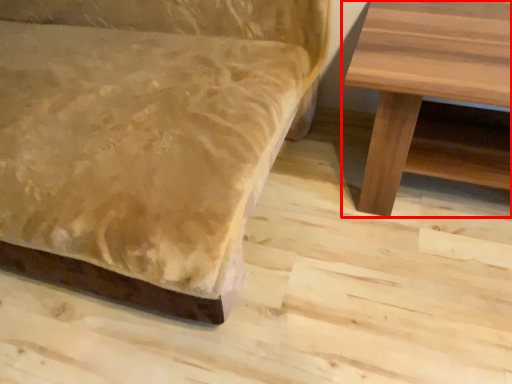
Question: Observing the image, what is the correct spatial positioning of table (annotated by the red box) in reference to studio couch?

Choices:
 (A) right
 (B) left

Answer: (A)